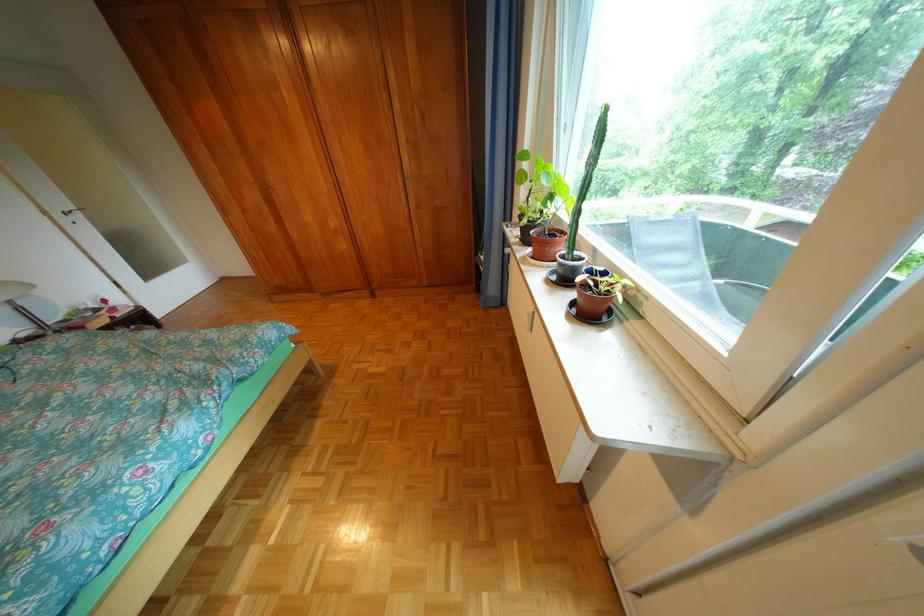
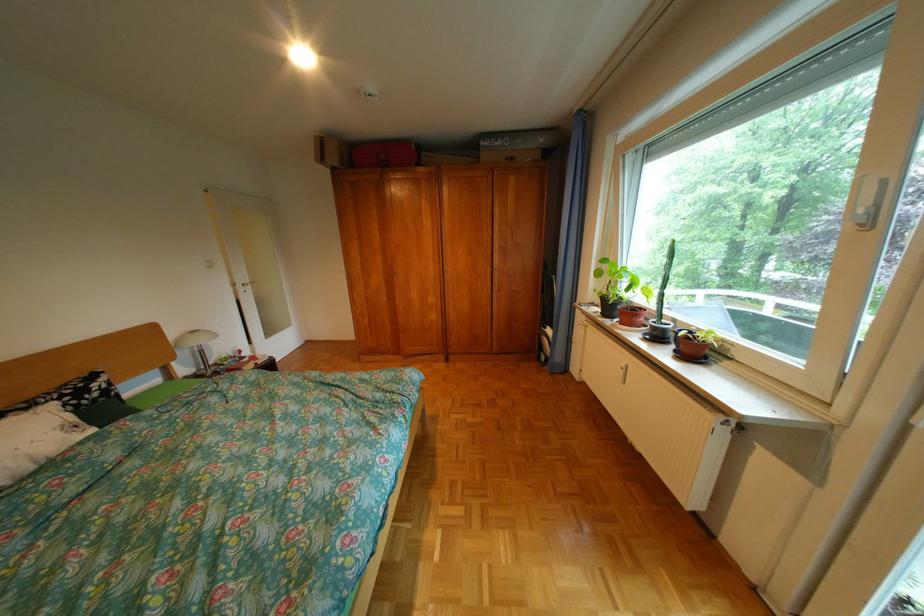
Question: How did the camera likely rotate?

Choices:
 (A) Left
 (B) Right
 (C) Up
 (D) Down

Answer: (C)